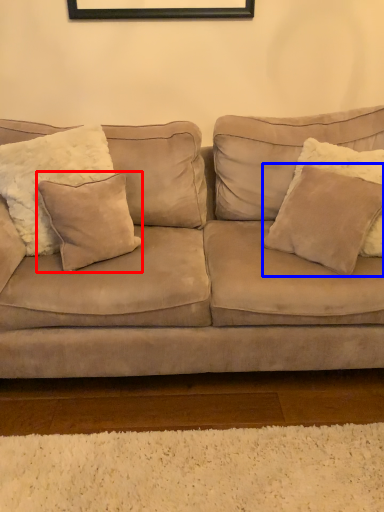
Question: Which object is further to the camera taking this photo, pillow (highlighted by a red box) or pillow (highlighted by a blue box)?

Choices:
 (A) pillow
 (B) pillow

Answer: (A)